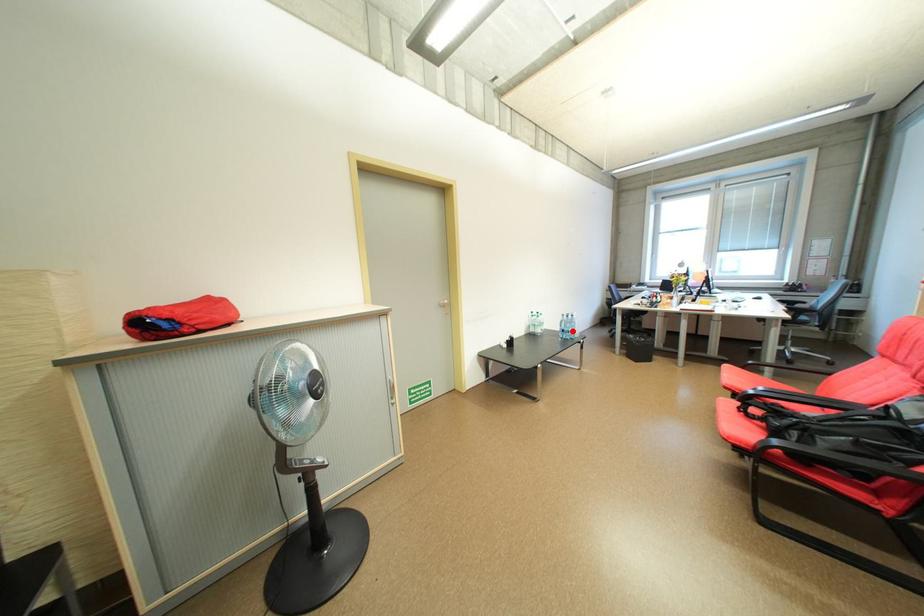
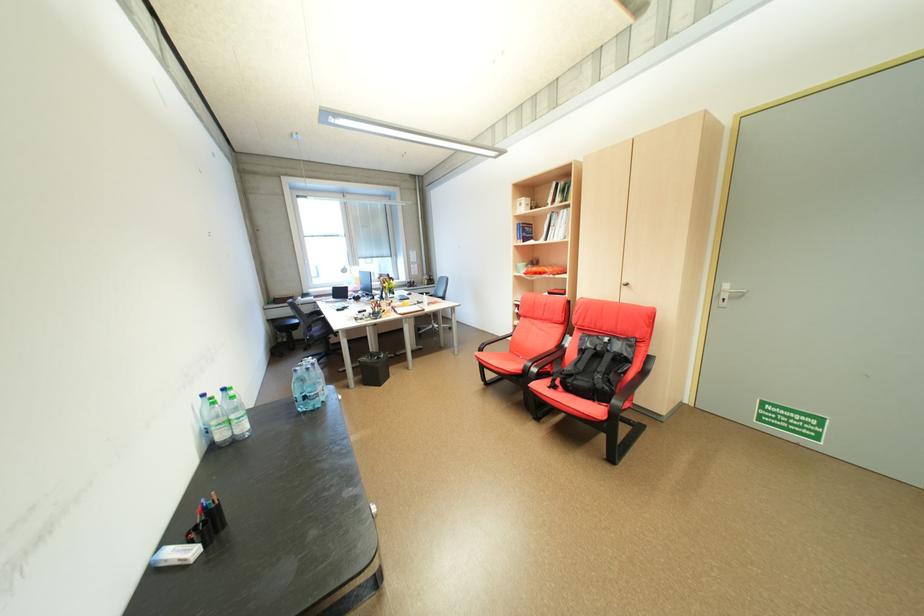
Question: I am providing you with two images of the same scene from different viewpoints. Given a red point in image1, look at the same physical point in image2. Is it:

Choices:
 (A) Closer to the viewpoint
 (B) Farther from the viewpoint

Answer: (A)